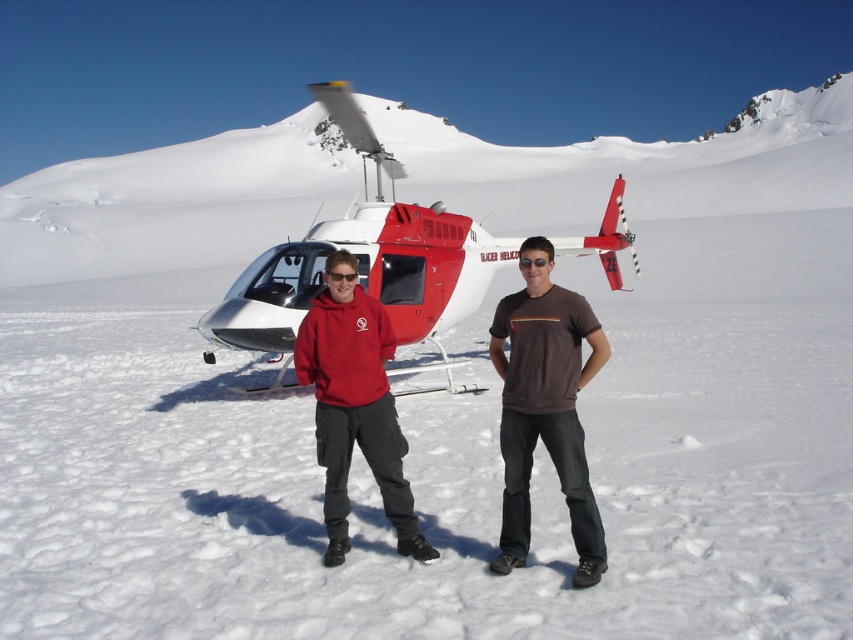
Question: Considering the real-world distances, which object is farthest from the matte red hoodie at center?

Choices:
 (A) black matte sunglasses at center
 (B) white matte helicopter at center
 (C) shiny black goggles at center
 (D) red fleece hoodie at center

Answer: (B)

Question: Which point is closer to the camera?

Choices:
 (A) shiny black goggles at center
 (B) brown cotton t-shirt at center
 (C) matte red hoodie at center

Answer: (B)

Question: Which object is positioned farthest from the red fleece hoodie at center?

Choices:
 (A) matte red hoodie at center
 (B) white matte helicopter at center
 (C) shiny black goggles at center

Answer: (B)

Question: Observing the image, what is the correct spatial positioning of red fleece hoodie at center in reference to black matte sunglasses at center?

Choices:
 (A) below
 (B) above

Answer: (A)

Question: Can you confirm if white matte helicopter at center is positioned below matte red hoodie at center?

Choices:
 (A) yes
 (B) no

Answer: (B)

Question: Where is white matte helicopter at center located in relation to matte red hoodie at center in the image?

Choices:
 (A) left
 (B) right

Answer: (A)